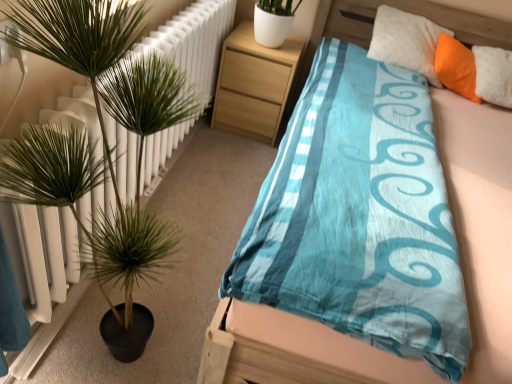
Question: Which direction should I rotate to look at light wood/texture nightstand at upper center?

Choices:
 (A) left
 (B) right

Answer: (B)

Question: Is the position of blue satin bed at center more distant than that of green leafy plant at left?

Choices:
 (A) no
 (B) yes

Answer: (B)

Question: Considering the relative sizes of blue satin bed at center and green leafy plant at left in the image provided, is blue satin bed at center smaller than green leafy plant at left?

Choices:
 (A) yes
 (B) no

Answer: (B)

Question: From the image's perspective, is blue satin bed at center located above green leafy plant at left?

Choices:
 (A) yes
 (B) no

Answer: (A)

Question: Is blue satin bed at center oriented away from green leafy plant at left?

Choices:
 (A) yes
 (B) no

Answer: (B)

Question: Is blue satin bed at center positioned before green leafy plant at left?

Choices:
 (A) no
 (B) yes

Answer: (A)

Question: From a real-world perspective, is blue satin bed at center below green leafy plant at left?

Choices:
 (A) no
 (B) yes

Answer: (B)

Question: Could you tell me if light wood/texture nightstand at upper center is facing blue satin bed at center?

Choices:
 (A) yes
 (B) no

Answer: (B)

Question: Is light wood/texture nightstand at upper center closer to camera compared to blue satin bed at center?

Choices:
 (A) no
 (B) yes

Answer: (A)

Question: Is light wood/texture nightstand at upper center far from blue satin bed at center?

Choices:
 (A) yes
 (B) no

Answer: (A)

Question: Are light wood/texture nightstand at upper center and blue satin bed at center beside each other?

Choices:
 (A) no
 (B) yes

Answer: (A)

Question: From a real-world perspective, is light wood/texture nightstand at upper center physically below blue satin bed at center?

Choices:
 (A) no
 (B) yes

Answer: (B)

Question: Considering the relative positions of light wood/texture nightstand at upper center and blue satin bed at center in the image provided, is light wood/texture nightstand at upper center to the right of blue satin bed at center from the viewer's perspective?

Choices:
 (A) no
 (B) yes

Answer: (A)

Question: From the image's perspective, is green leafy plant at left under light wood/texture nightstand at upper center?

Choices:
 (A) yes
 (B) no

Answer: (A)